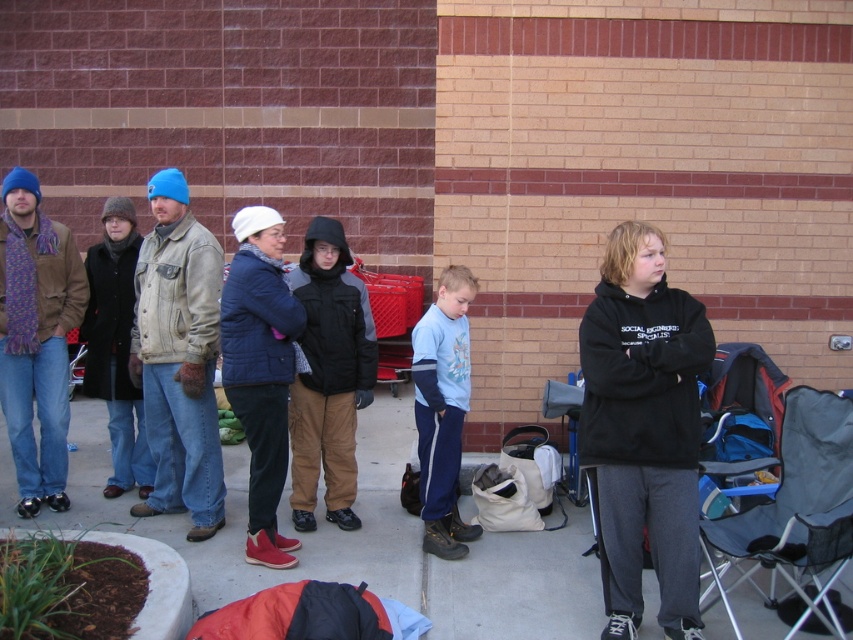
Question: Which point is farther to the camera?

Choices:
 (A) (433, 468)
 (B) (403, 436)

Answer: (B)

Question: In this image, where is concrete pavement at center located relative to black fabric folding chair at lower right?

Choices:
 (A) above
 (B) below

Answer: (B)

Question: Is denim jacket at center above black fabric folding chair at lower right?

Choices:
 (A) yes
 (B) no

Answer: (A)

Question: Is concrete pavement at center below blue fleece sweatshirt at center?

Choices:
 (A) no
 (B) yes

Answer: (B)

Question: Which of these objects is positioned closest to the black fabric folding chair at lower right?

Choices:
 (A) denim jacket at center
 (B) blue fleece sweatshirt at center
 (C) concrete pavement at center

Answer: (C)

Question: Which point is farther to the camera?

Choices:
 (A) (440, 403)
 (B) (138, 307)
 (C) (234, 531)
 (D) (833, 474)

Answer: (B)